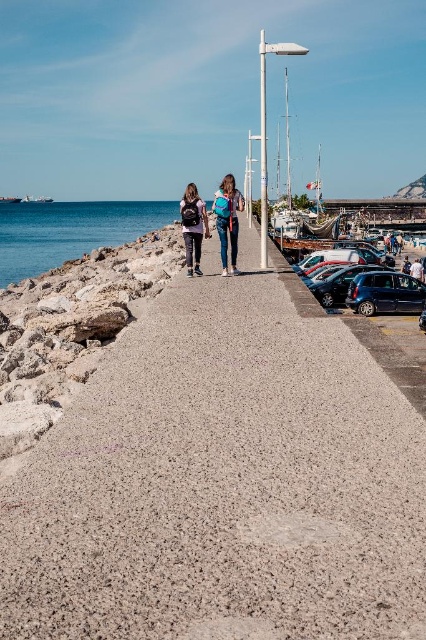
Based on the photo, does matte black backpack at center appear on the left side of shiny metallic car at right?

Correct, you'll find matte black backpack at center to the left of shiny metallic car at right.

Is point (187, 202) less distant than point (321, 284)?

Yes.

Is point (192, 230) closer to viewer compared to point (321, 284)?

Yes, it is.

I want to click on matte black backpack at center, so click(x=192, y=227).

Is matte blue backpack at center thinner than shiny metallic car at right?

Yes.

Looking at this image, can you confirm if matte blue backpack at center is positioned above shiny metallic car at right?

Correct, matte blue backpack at center is located above shiny metallic car at right.

Between point (184, 230) and point (336, 291), which one is positioned in front?

Point (184, 230) is in front.

I want to click on matte blue backpack at center, so click(227, 220).

Who is more forward, [187,264] or [389,240]?

Positioned in front is point [187,264].

Is matte black backpack at center below denim jacket at center?

Indeed, matte black backpack at center is positioned under denim jacket at center.

Locate an element on the screen. Image resolution: width=426 pixels, height=640 pixels. matte black backpack at center is located at coordinates (192, 227).